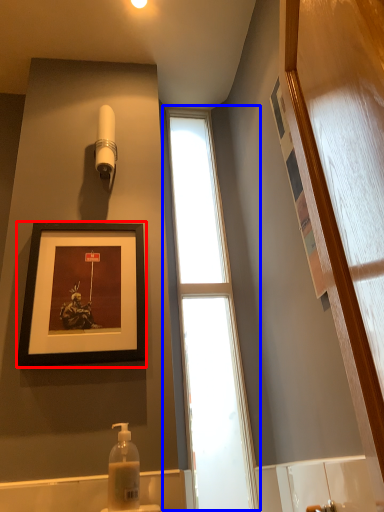
Question: Which object is further to the camera taking this photo, picture frame (highlighted by a red box) or window (highlighted by a blue box)?

Choices:
 (A) picture frame
 (B) window

Answer: (B)